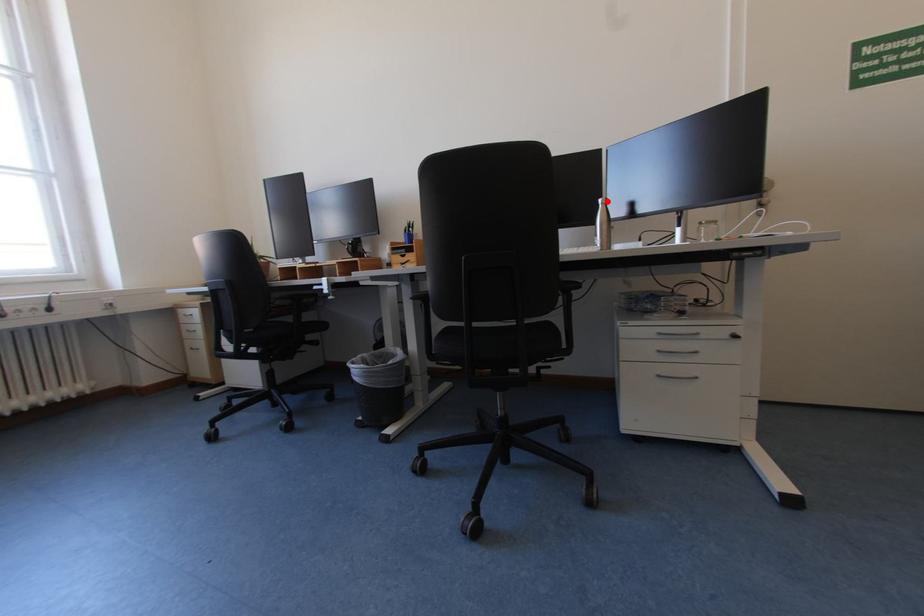
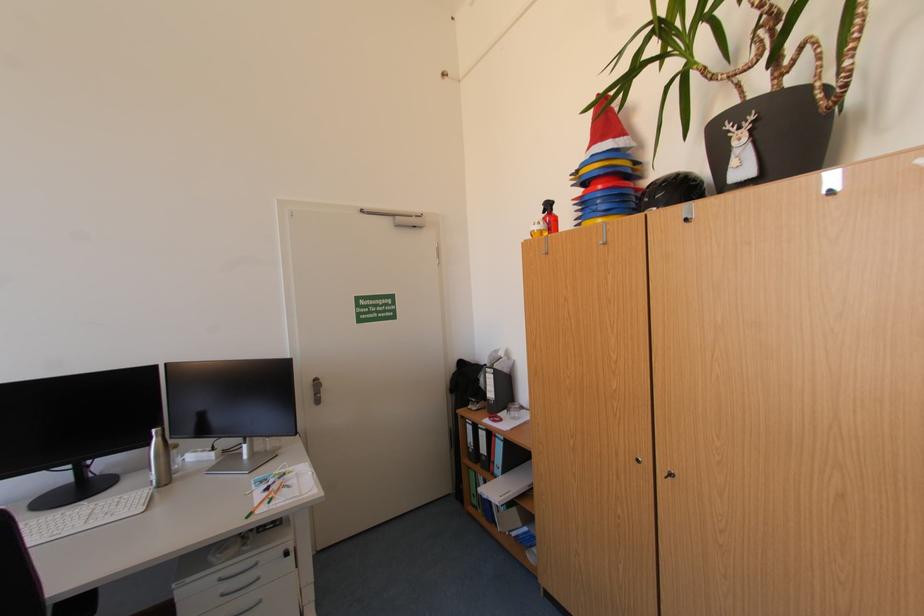
The point at the highlighted location is marked in the first image. Where is the corresponding point in the second image?

(161, 431)